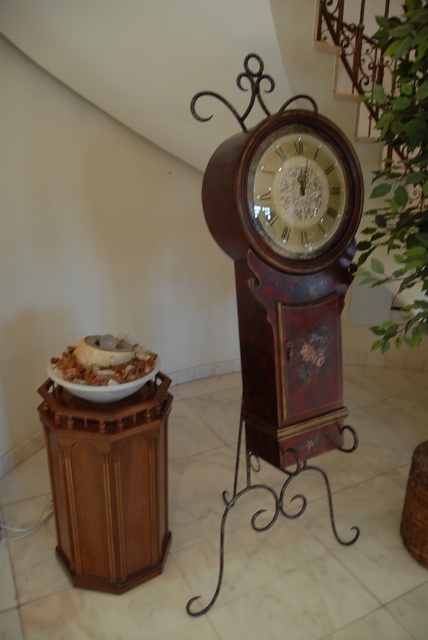
Question: Which of the following is the farthest from the observer?

Choices:
 (A) (124, 385)
 (B) (278, 225)
 (C) (73, 349)

Answer: (C)

Question: Which point is closer to the camera?

Choices:
 (A) shiny brown bowl at lower left
 (B) wooden clock at center

Answer: (B)

Question: Is shiny brown bowl at lower left to the left of white matte plate at left from the viewer's perspective?

Choices:
 (A) no
 (B) yes

Answer: (B)

Question: Based on their relative distances, which object is nearer to the white matte plate at left?

Choices:
 (A) wooden clock at center
 (B) shiny brown bowl at lower left

Answer: (B)

Question: Is wooden clock at center smaller than white matte plate at left?

Choices:
 (A) yes
 (B) no

Answer: (B)

Question: Where is wooden clock at center located in relation to white matte plate at left in the image?

Choices:
 (A) above
 (B) below

Answer: (A)